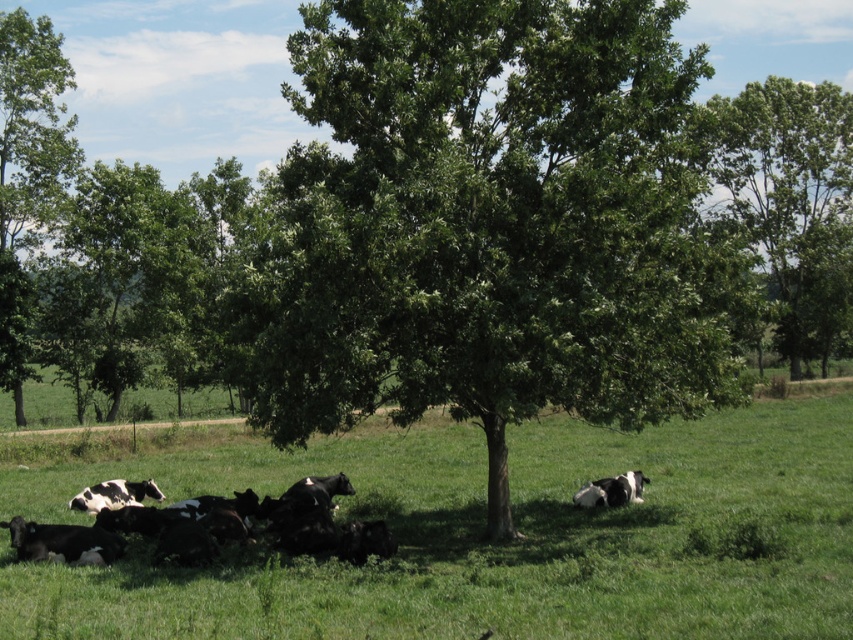
You are a farmer standing at the edge of the field. You notice the green leafy tree at upper left and the black and white fur at lower left. Which object is taller?

The green leafy tree at upper left is much taller than the black and white fur at lower left.